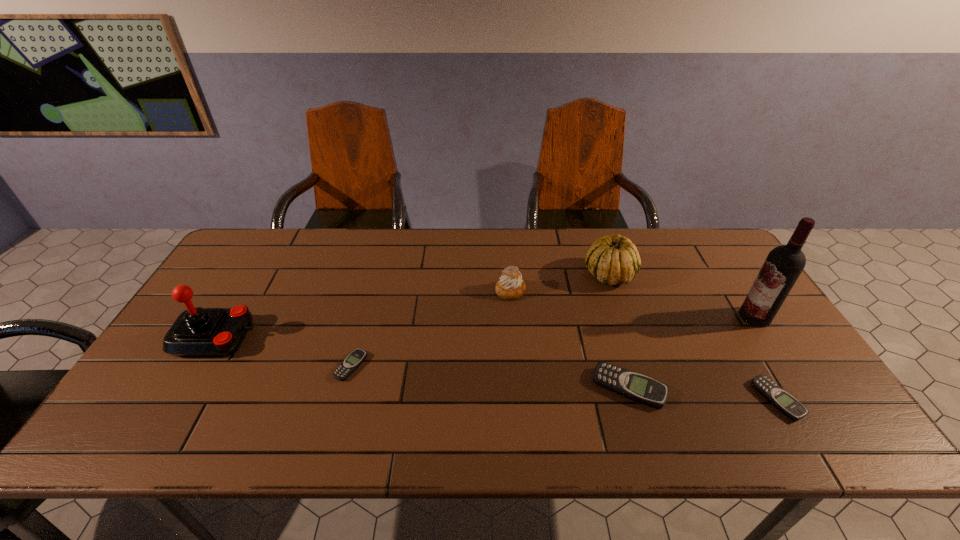
Locate an element on the screen. The image size is (960, 540). free space that satisfies the following two spatial constraints: 1. on the base of the second tallest object; 2. on the back side of the rightmost beeper is located at coordinates (180, 400).